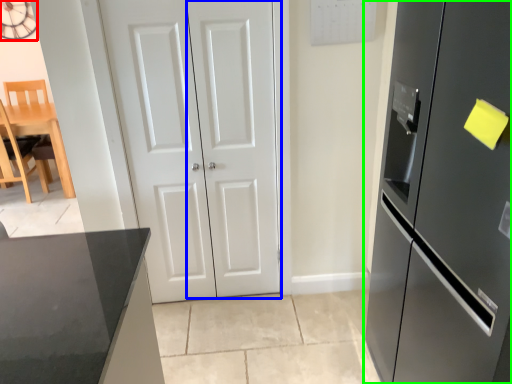
Question: Which object is positioned closest to clock (highlighted by a red box)? Select from door (highlighted by a blue box) and refrigerator (highlighted by a green box).

Choices:
 (A) door
 (B) refrigerator

Answer: (A)